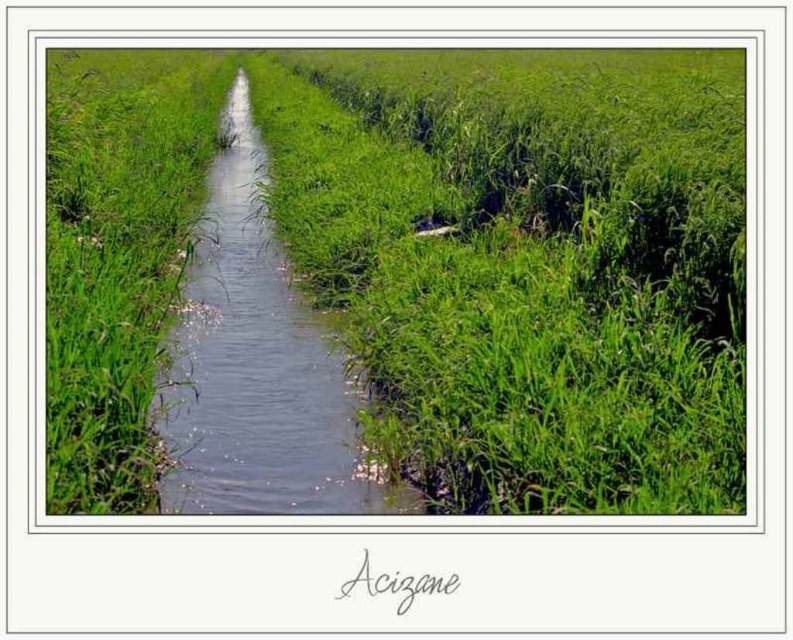
Is green grass at center shorter than clear water stream at center?

No, green grass at center is not shorter than clear water stream at center.

Between point (347, 113) and point (255, 196), which one is positioned in front?

Point (255, 196)

Which is in front, point (144, 301) or point (198, 506)?

Positioned in front is point (198, 506).

At what (x,y) coordinates should I click in order to perform the action: click on green grass at center. Please return your answer as a coordinate pair (x, y). Looking at the image, I should click on (437, 259).